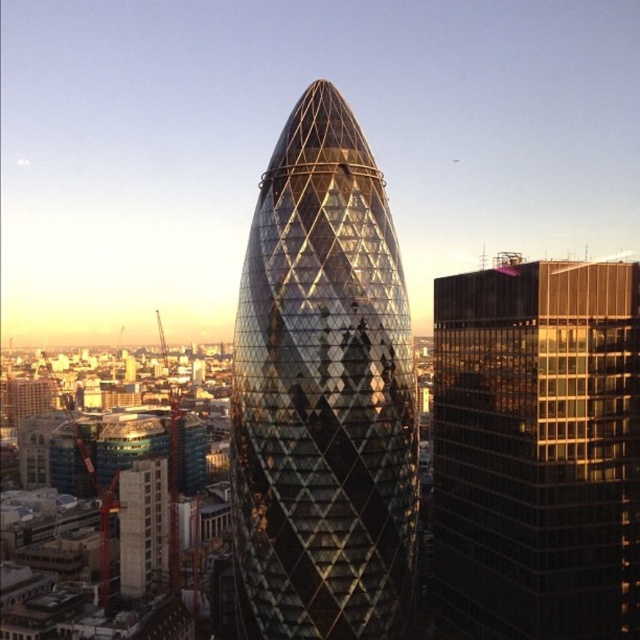
Question: Is shiny glass tower at center wider than black glass building at right?

Choices:
 (A) yes
 (B) no

Answer: (A)

Question: Among these points, which one is farthest from the camera?

Choices:
 (A) (442, 625)
 (B) (332, 352)

Answer: (A)

Question: Which point is closer to the camera?

Choices:
 (A) (440, 358)
 (B) (401, 516)

Answer: (B)

Question: Can you confirm if shiny glass tower at center is smaller than black glass building at right?

Choices:
 (A) no
 (B) yes

Answer: (A)

Question: Is shiny glass tower at center further to camera compared to black glass building at right?

Choices:
 (A) no
 (B) yes

Answer: (A)